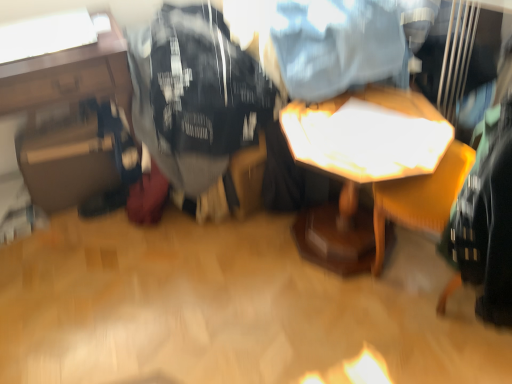
Question: Can you confirm if black cotton t-shirt at center is positioned to the left of wooden table at center, the first table when ordered from right to left?

Choices:
 (A) no
 (B) yes

Answer: (B)

Question: Is black cotton t-shirt at center not inside wooden table at center, the first table when ordered from right to left?

Choices:
 (A) yes
 (B) no

Answer: (A)

Question: Is black cotton t-shirt at center aimed at wooden table at center, the second table in the left-to-right sequence?

Choices:
 (A) no
 (B) yes

Answer: (A)

Question: Is black cotton t-shirt at center looking in the opposite direction of wooden table at center, the second table in the left-to-right sequence?

Choices:
 (A) no
 (B) yes

Answer: (A)

Question: From a real-world perspective, is black cotton t-shirt at center beneath wooden table at center, the second table in the left-to-right sequence?

Choices:
 (A) no
 (B) yes

Answer: (A)

Question: Considering their positions, is wooden table at center, the second table in the left-to-right sequence, located in front of or behind black cotton t-shirt at center?

Choices:
 (A) behind
 (B) front

Answer: (B)

Question: From a real-world perspective, is wooden table at center, the second table in the left-to-right sequence, above or below black cotton t-shirt at center?

Choices:
 (A) above
 (B) below

Answer: (B)

Question: Considering the positions of wooden table at center, the second table in the left-to-right sequence, and black cotton t-shirt at center in the image, is wooden table at center, the second table in the left-to-right sequence, wider or thinner than black cotton t-shirt at center?

Choices:
 (A) wide
 (B) thin

Answer: (B)

Question: From the image's perspective, is wooden table at center, the second table in the left-to-right sequence, positioned above or below black cotton t-shirt at center?

Choices:
 (A) below
 (B) above

Answer: (A)

Question: Considering the positions of matte black suitcase at left, placed as the 2th table when sorted from right to left, and black cotton t-shirt at center in the image, is matte black suitcase at left, placed as the 2th table when sorted from right to left, taller or shorter than black cotton t-shirt at center?

Choices:
 (A) short
 (B) tall

Answer: (B)

Question: In terms of size, does matte black suitcase at left, which is the 1th table in left-to-right order, appear bigger or smaller than black cotton t-shirt at center?

Choices:
 (A) small
 (B) big

Answer: (B)

Question: Looking at their shapes, would you say matte black suitcase at left, which is the 1th table in left-to-right order, is wider or thinner than black cotton t-shirt at center?

Choices:
 (A) wide
 (B) thin

Answer: (B)

Question: From a real-world perspective, is matte black suitcase at left, which is the 1th table in left-to-right order, physically located above or below black cotton t-shirt at center?

Choices:
 (A) above
 (B) below

Answer: (B)

Question: From a real-world perspective, is black cotton t-shirt at center above or below wooden table at center, the second table in the left-to-right sequence?

Choices:
 (A) below
 (B) above

Answer: (B)

Question: Considering their positions, is black cotton t-shirt at center located in front of or behind wooden table at center, the second table in the left-to-right sequence?

Choices:
 (A) front
 (B) behind

Answer: (B)